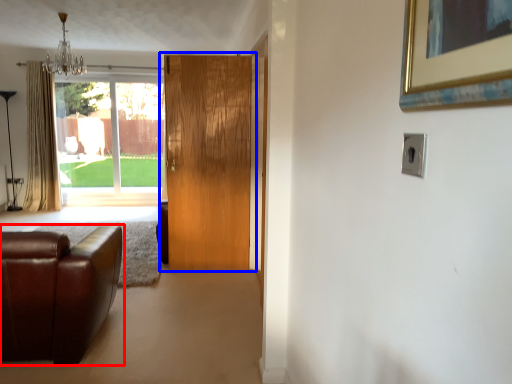
Question: Which point is further to the camera, studio couch (highlighted by a red box) or door (highlighted by a blue box)?

Choices:
 (A) studio couch
 (B) door

Answer: (B)